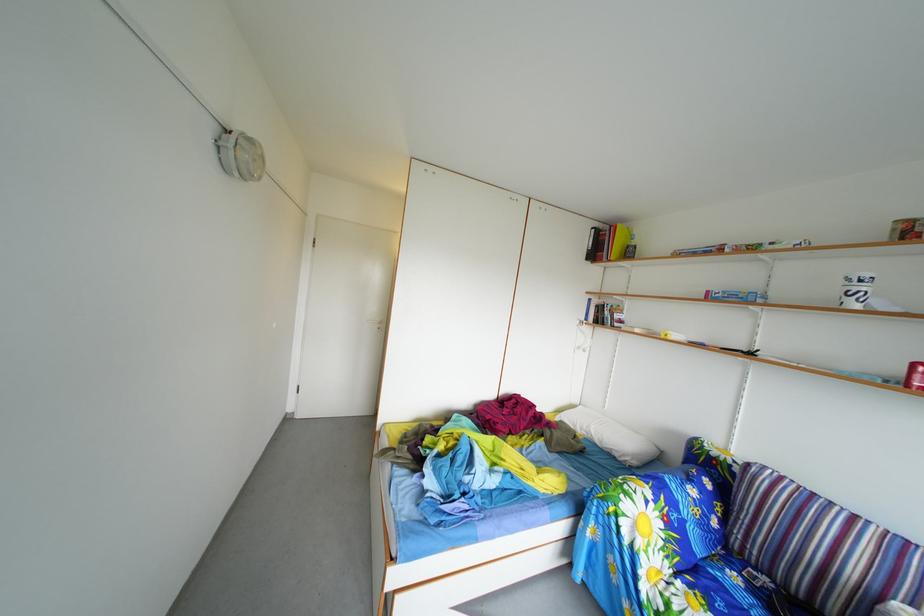
What do you see at coordinates (617, 241) in the screenshot? The height and width of the screenshot is (616, 924). I see `the yellow book binder` at bounding box center [617, 241].